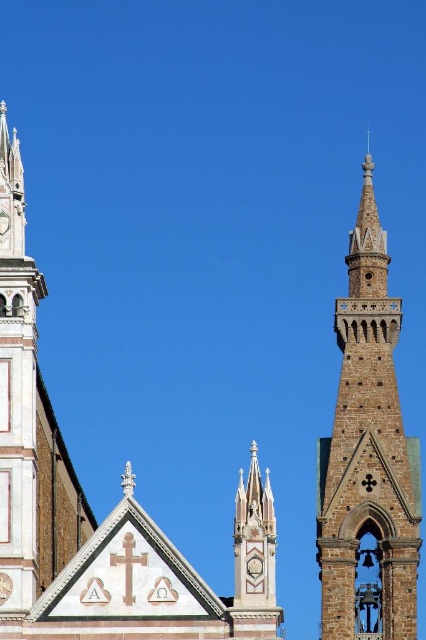
Is white stone church at upper center positioned in front of white marble tower at left?

Yes, it is in front of white marble tower at left.

Consider the image. How far apart are white stone church at upper center and white marble tower at left?

They are 16.63 feet apart.

Who is more forward, (x=60, y=493) or (x=17, y=593)?

Positioned in front is point (x=17, y=593).

The image size is (426, 640). In order to click on white stone church at upper center in this screenshot , I will do `click(89, 506)`.

Does point (377, 493) come in front of point (8, 218)?

Yes, point (377, 493) is closer to viewer.

Image resolution: width=426 pixels, height=640 pixels. Describe the element at coordinates (368, 449) in the screenshot. I see `brown stone spire at upper right` at that location.

Image resolution: width=426 pixels, height=640 pixels. Find the location of `brown stone spire at upper right`. brown stone spire at upper right is located at coordinates (368, 449).

Can you confirm if white stone church at upper center is positioned to the left of brown stone spire at upper right?

Indeed, white stone church at upper center is positioned on the left side of brown stone spire at upper right.

Which is more to the right, white stone church at upper center or brown stone spire at upper right?

From the viewer's perspective, brown stone spire at upper right appears more on the right side.

At what (x,y) coordinates should I click in order to perform the action: click on white stone church at upper center. Please return your answer as a coordinate pair (x, y). The image size is (426, 640). Looking at the image, I should click on (89, 506).